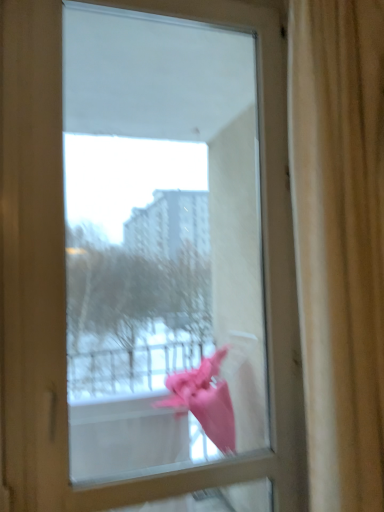
At what (x,y) coordinates should I click in order to perform the action: click on beige fabric curtain at right. Please return your answer as a coordinate pair (x, y). This screenshot has height=512, width=384. Looking at the image, I should click on (340, 242).

In order to face beige fabric curtain at right, should I rotate leftwards or rightwards?

You should rotate right by 20.283 degrees.

Image resolution: width=384 pixels, height=512 pixels. What do you see at coordinates (340, 242) in the screenshot?
I see `beige fabric curtain at right` at bounding box center [340, 242].

Image resolution: width=384 pixels, height=512 pixels. In order to click on beige fabric curtain at right in this screenshot , I will do `click(340, 242)`.